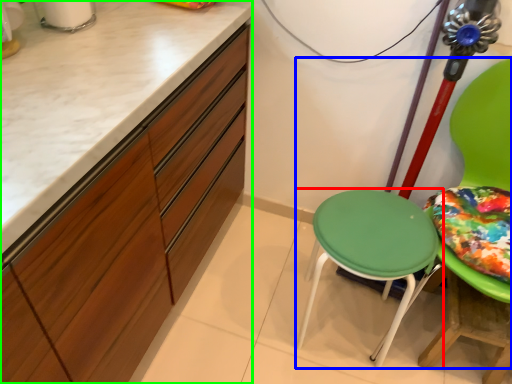
Question: Which object is the closest to the stool (highlighted by a red box)? Choose among these: chair (highlighted by a blue box) or cabinetry (highlighted by a green box).

Choices:
 (A) chair
 (B) cabinetry

Answer: (A)